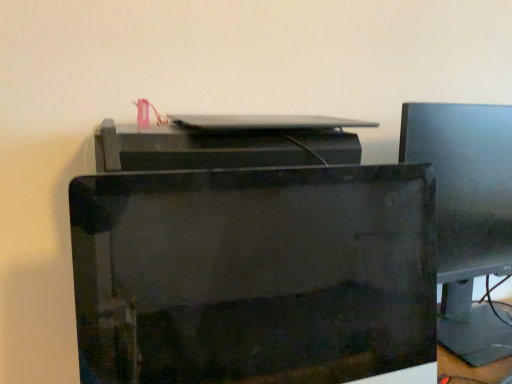
Question: Can you confirm if matte black monitor at right is thinner than glossy black printer at center?

Choices:
 (A) no
 (B) yes

Answer: (A)

Question: Would you say matte black monitor at right is a long distance from glossy black printer at center?

Choices:
 (A) no
 (B) yes

Answer: (A)

Question: Does matte black monitor at right turn towards glossy black printer at center?

Choices:
 (A) yes
 (B) no

Answer: (B)

Question: Considering the relative sizes of matte black monitor at right and glossy black printer at center in the image provided, is matte black monitor at right taller than glossy black printer at center?

Choices:
 (A) no
 (B) yes

Answer: (B)

Question: Is glossy black printer at center completely or partially inside matte black monitor at right?

Choices:
 (A) no
 (B) yes

Answer: (A)

Question: Looking at the image, does glossy black printer at center seem bigger or smaller compared to matte black monitor at right?

Choices:
 (A) big
 (B) small

Answer: (B)

Question: Is glossy black printer at center to the left or to the right of matte black monitor at right in the image?

Choices:
 (A) left
 (B) right

Answer: (A)

Question: From the image's perspective, is glossy black printer at center positioned above or below matte black monitor at right?

Choices:
 (A) below
 (B) above

Answer: (A)

Question: From their relative heights in the image, would you say glossy black printer at center is taller or shorter than matte black monitor at right?

Choices:
 (A) tall
 (B) short

Answer: (B)

Question: Visually, is satin silver laptop at center positioned to the left or to the right of matte black monitor at right?

Choices:
 (A) right
 (B) left

Answer: (B)

Question: From the image's perspective, is satin silver laptop at center located above or below matte black monitor at right?

Choices:
 (A) above
 (B) below

Answer: (A)

Question: Considering the positions of satin silver laptop at center and matte black monitor at right in the image, is satin silver laptop at center taller or shorter than matte black monitor at right?

Choices:
 (A) tall
 (B) short

Answer: (B)

Question: Considering their positions, is satin silver laptop at center located in front of or behind matte black monitor at right?

Choices:
 (A) front
 (B) behind

Answer: (A)

Question: In the image, is matte black monitor at right on the left side or the right side of satin silver laptop at center?

Choices:
 (A) left
 (B) right

Answer: (B)

Question: Considering the positions of matte black monitor at right and satin silver laptop at center in the image, is matte black monitor at right bigger or smaller than satin silver laptop at center?

Choices:
 (A) big
 (B) small

Answer: (A)